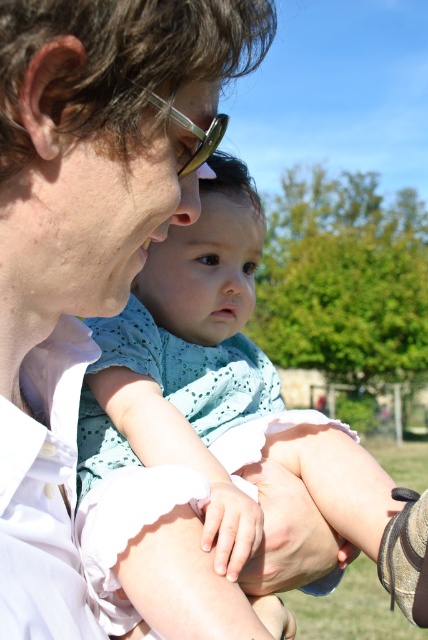
You are a photographer trying to capture the perfect shot of the scene. You notice two points in the image at coordinates point (309, 428) and point (246, 529). If you want to focus on the closer point to the viewer, which coordinate should you adjust your camera to?

Point (309, 428) is further to the viewer than point (246, 529), so you should adjust your camera to focus on point (246, 529) since it is closer to the viewer.

In the scene shown: You are a photographer trying to capture the baby in the light blue fabric at center. The adult is wearing a matte white shirt at center. To ensure the baby is in focus, you need to know their position relative to the adult. Is the baby to the right or left of the adult?

The baby in the light blue fabric at center is to the right of the adult wearing the matte white shirt at center, since the matte white shirt at center is to the left of the light blue fabric at center.